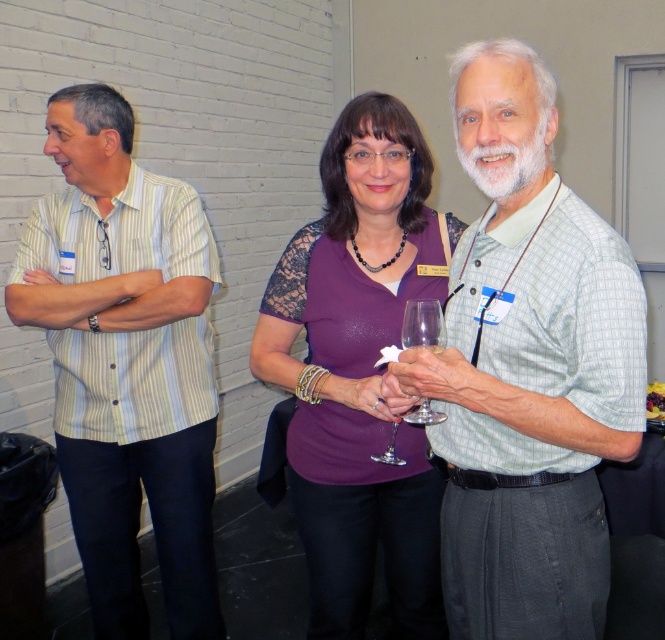
Does purple lace top at center lie in front of clear glass wine glass at center?

No.

What do you see at coordinates (358, 372) in the screenshot? The image size is (665, 640). I see `purple lace top at center` at bounding box center [358, 372].

Is point (327, 252) farther from viewer compared to point (436, 305)?

That is True.

At what (x,y) coordinates should I click in order to perform the action: click on purple lace top at center. Please return your answer as a coordinate pair (x, y). Looking at the image, I should click on (358, 372).

Does purple lace top at center have a larger size compared to purple lace sleeve at center?

Indeed, purple lace top at center has a larger size compared to purple lace sleeve at center.

The image size is (665, 640). I want to click on purple lace top at center, so click(358, 372).

Which is above, striped cotton shirt at left or purple lace top at center?

Positioned higher is purple lace top at center.

Based on the photo, can you confirm if striped cotton shirt at left is smaller than purple lace top at center?

No.

The height and width of the screenshot is (640, 665). What are the coordinates of `striped cotton shirt at left` in the screenshot? It's located at (126, 362).

This screenshot has width=665, height=640. I want to click on striped cotton shirt at left, so click(x=126, y=362).